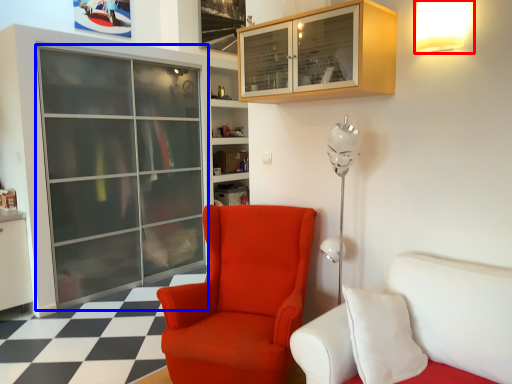
Question: Which object appears closest to the camera in this image, light fixture (highlighted by a red box) or screen door (highlighted by a blue box)?

Choices:
 (A) light fixture
 (B) screen door

Answer: (A)